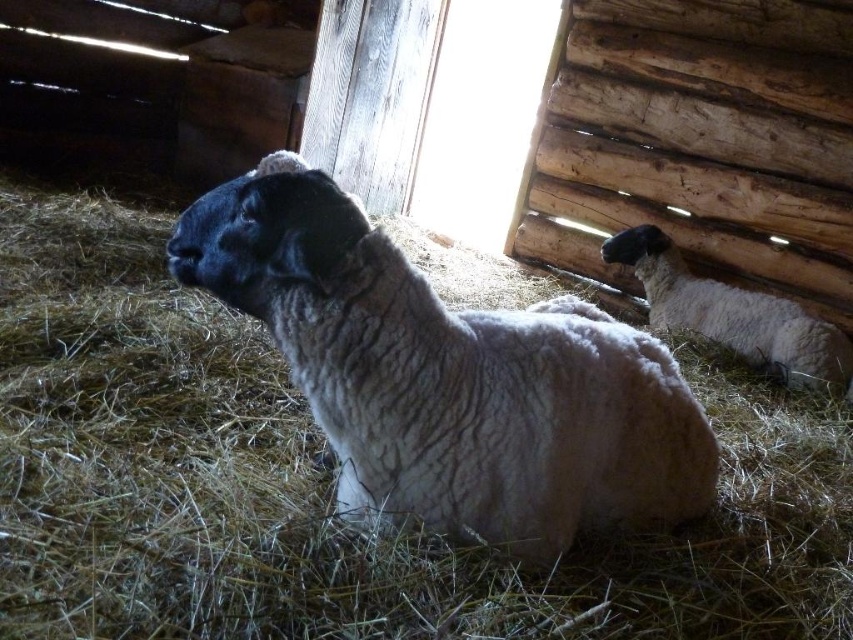
Who is positioned more to the left, white woolen sheep at center or white woolen sheep at right?

white woolen sheep at center is more to the left.

Is white woolen sheep at center smaller than white woolen sheep at right?

No, white woolen sheep at center is not smaller than white woolen sheep at right.

From the picture: Who is more forward, [312,259] or [730,304]?

Positioned in front is point [312,259].

Identify the location of white woolen sheep at center. (450, 376).